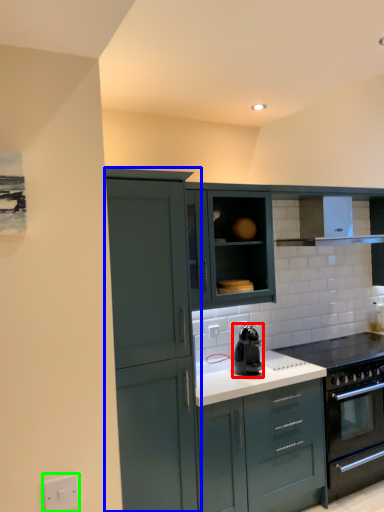
Question: Considering the real-world distances, which object is closest to kitchen appliance (highlighted by a red box)? cabinetry (highlighted by a blue box) or electric outlet (highlighted by a green box).

Choices:
 (A) cabinetry
 (B) electric outlet

Answer: (A)